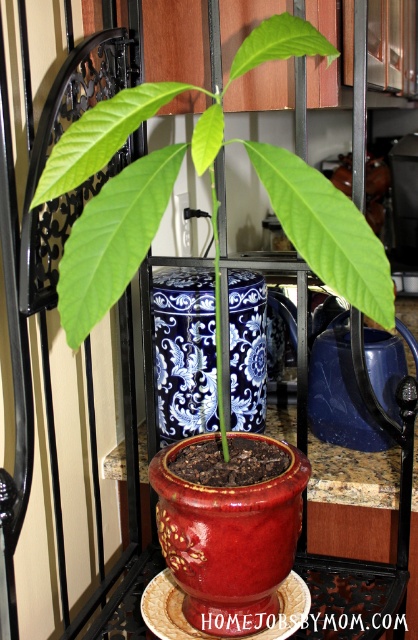
Is point (150, 480) positioned in front of point (254, 406)?

Yes, it is in front of point (254, 406).

Who is lower down, red glossy pot at center or blue and white porcelain vase at center?

red glossy pot at center is lower down.

Which is in front, point (191, 504) or point (188, 406)?

Positioned in front is point (191, 504).

The height and width of the screenshot is (640, 418). Find the location of `red glossy pot at center`. red glossy pot at center is located at coordinates (227, 536).

Consider the image. Which of these two, glossy ceramic pot at center or red glossy pot at center, stands taller?

glossy ceramic pot at center

Who is more forward, (129, 90) or (214, 444)?

Point (129, 90) is in front.

Which is behind, point (270, 40) or point (257, 637)?

The point (257, 637) is behind.

At what (x,y) coordinates should I click in order to perform the action: click on glossy ceramic pot at center. Please return your answer as a coordinate pair (x, y). Image resolution: width=418 pixels, height=640 pixels. Looking at the image, I should click on (140, 173).

Is glossy ceramic pot at center taller than blue and white porcelain vase at center?

Yes, glossy ceramic pot at center is taller than blue and white porcelain vase at center.

Consider the image. Which is more to the left, glossy ceramic pot at center or blue and white porcelain vase at center?

Positioned to the left is blue and white porcelain vase at center.

Between point (385, 264) and point (214, 396), which one is positioned in front?

Point (385, 264)

The width and height of the screenshot is (418, 640). In order to click on glossy ceramic pot at center in this screenshot , I will do `click(140, 173)`.